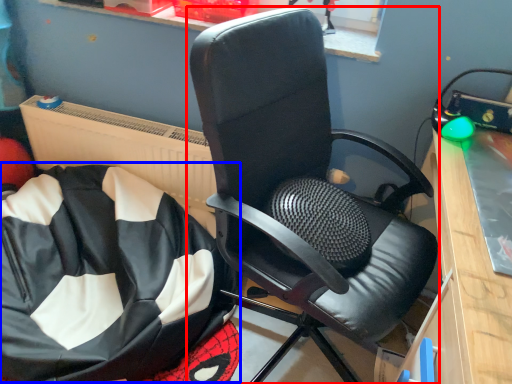
Question: Which point is further to the camera, chair (highlighted by a red box) or bean bag chair (highlighted by a blue box)?

Choices:
 (A) chair
 (B) bean bag chair

Answer: (B)